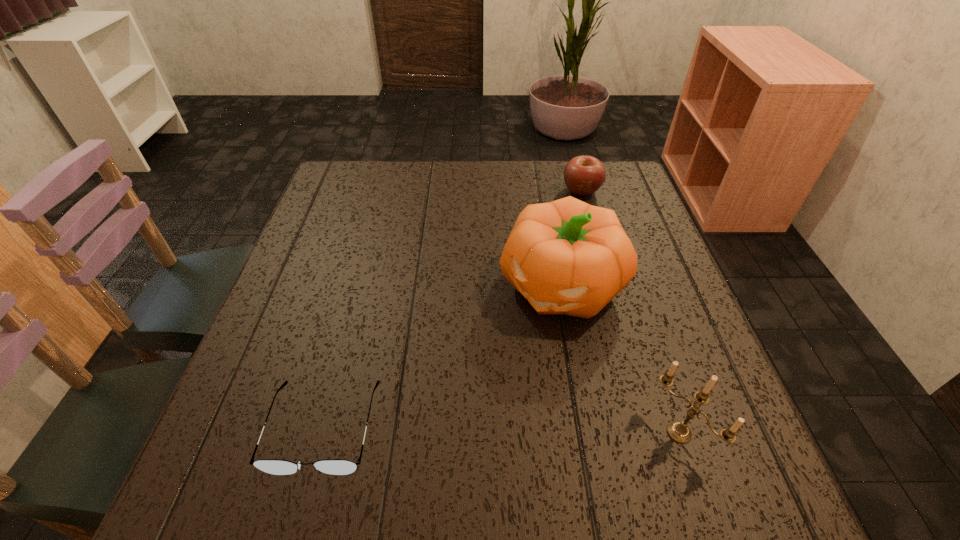
Find the location of a particular element. Image resolution: width=960 pixels, height=540 pixels. spectacles is located at coordinates (272, 466).

Identify the location of the shortest object. (272, 466).

The height and width of the screenshot is (540, 960). I want to click on candle, so click(x=678, y=431).

Identify the location of the farthest object. (583, 175).

This screenshot has height=540, width=960. I want to click on apple, so click(583, 175).

Where is `pumpkin`? pumpkin is located at coordinates (568, 257).

Image resolution: width=960 pixels, height=540 pixels. What are the coordinates of `the second farthest object` in the screenshot? It's located at (568, 257).

At what (x,y) coordinates should I click in order to perform the action: click on free space located on the left of the third shortest object. Please return your answer as a coordinate pair (x, y). This screenshot has height=540, width=960. Looking at the image, I should click on [423, 433].

You are a GUI agent. You are given a task and a screenshot of the screen. Output one action in this format:
    pyautogui.click(x=<x>, y=<y>)
    Task: Click on the free point located on the side of the second shortest object with the unique marking
    Image resolution: width=960 pixels, height=540 pixels.
    Given the screenshot: What is the action you would take?
    pyautogui.click(x=570, y=212)

At what (x,y) coordinates should I click in order to perform the action: click on vacant area situated on the side of the second shortest object with the unique marking. Please return your answer as a coordinate pair (x, y). Looking at the image, I should click on (554, 242).